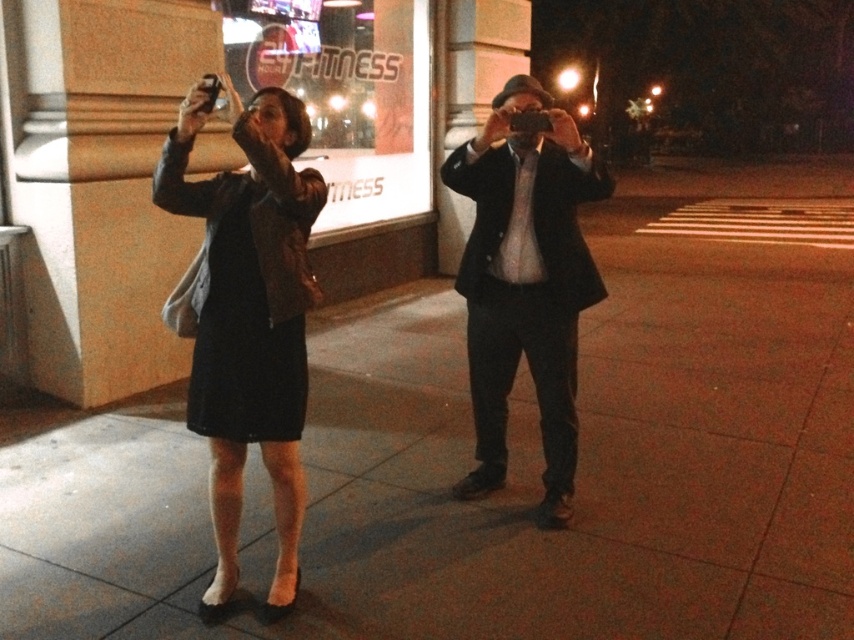
You are a photographer trying to capture both the leather jacket at left and the dark suit at center in a single frame. Based on their positions, which one should you focus on first to ensure both are in the shot?

Since the leather jacket at left is positioned to the left of the dark suit at center, you should focus on the dark suit at center first to ensure both are within the frame.

You are a photographer standing at the center of the sidewalk. You want to take a photo of the leather jacket at left. Where should you aim your camera to capture it?

You should aim your camera at point (247, 316) to capture the leather jacket at left.

You are standing on the sidewalk and see the point marked at coordinates (247, 316). What object is located at that point?

The point at coordinates (247, 316) marks the leather jacket at left.